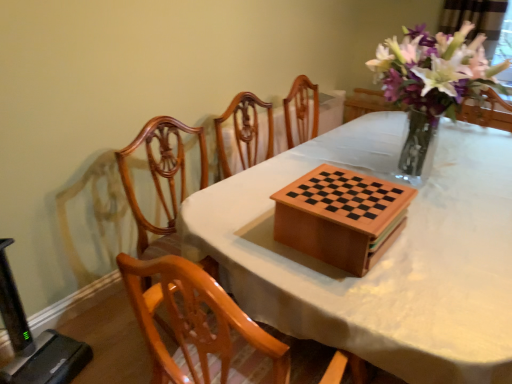
Question: From a real-world perspective, does polished wood chair at center stand above translucent glass vase at upper right?

Choices:
 (A) yes
 (B) no

Answer: (B)

Question: Considering the relative sizes of polished wood chair at center and translucent glass vase at upper right in the image provided, is polished wood chair at center shorter than translucent glass vase at upper right?

Choices:
 (A) yes
 (B) no

Answer: (B)

Question: Is polished wood chair at center not near translucent glass vase at upper right?

Choices:
 (A) yes
 (B) no

Answer: (A)

Question: Considering the relative positions of polished wood chair at center and translucent glass vase at upper right in the image provided, is polished wood chair at center to the left of translucent glass vase at upper right from the viewer's perspective?

Choices:
 (A) no
 (B) yes

Answer: (B)

Question: From a real-world perspective, is polished wood chair at center under translucent glass vase at upper right?

Choices:
 (A) yes
 (B) no

Answer: (A)

Question: Is polished wood chair at center thinner than translucent glass vase at upper right?

Choices:
 (A) no
 (B) yes

Answer: (A)

Question: Considering the relative sizes of wooden chess set at center and translucent glass vase at upper right in the image provided, is wooden chess set at center taller than translucent glass vase at upper right?

Choices:
 (A) no
 (B) yes

Answer: (B)

Question: Considering the relative sizes of wooden chess set at center and translucent glass vase at upper right in the image provided, is wooden chess set at center wider than translucent glass vase at upper right?

Choices:
 (A) yes
 (B) no

Answer: (A)

Question: Is wooden chess set at center positioned far away from translucent glass vase at upper right?

Choices:
 (A) no
 (B) yes

Answer: (B)

Question: Is wooden chess set at center behind translucent glass vase at upper right?

Choices:
 (A) no
 (B) yes

Answer: (A)

Question: From the image's perspective, is wooden chess set at center on translucent glass vase at upper right?

Choices:
 (A) no
 (B) yes

Answer: (A)

Question: Is wooden chess set at center smaller than translucent glass vase at upper right?

Choices:
 (A) yes
 (B) no

Answer: (B)

Question: From a real-world perspective, is translucent glass vase at upper right positioned under polished wood chair at center based on gravity?

Choices:
 (A) yes
 (B) no

Answer: (B)